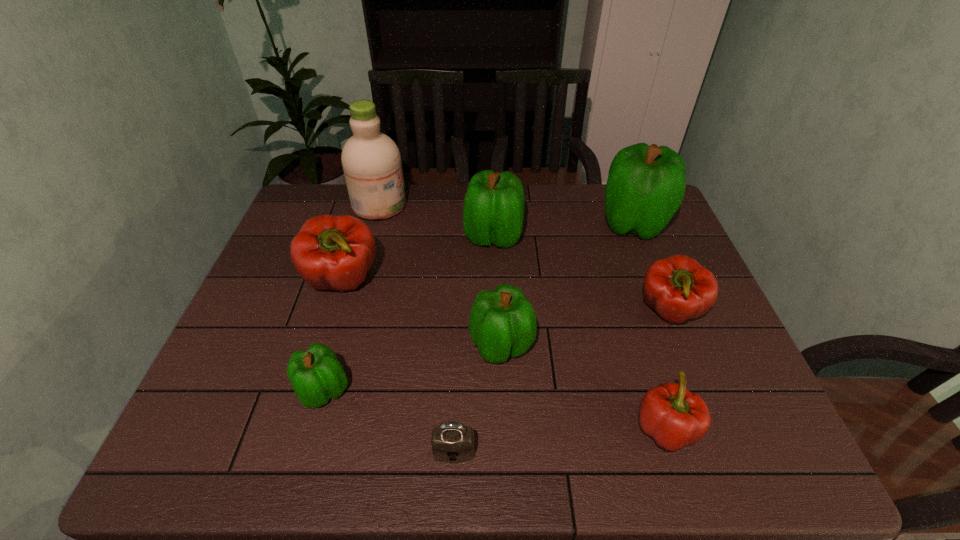
What are the coordinates of `free location located on the front label of the cleansing agent` in the screenshot? It's located at (502, 205).

The image size is (960, 540). Identify the location of free region located 0.140m on the front of the biggest green bell pepper. (655, 280).

Identify the location of vacant space situated on the right of the second biggest green bell pepper. coord(626,237).

Where is `free point located on the front of the leftmost pink bell pepper`? free point located on the front of the leftmost pink bell pepper is located at coordinates (327, 335).

Identify the location of free spot located 0.250m on the right of the second smallest green bell pepper. The image size is (960, 540). (636, 346).

You are a GUI agent. You are given a task and a screenshot of the screen. Output one action in this format:
    pyautogui.click(x=<x>, y=<y>)
    Task: Click on the vacant space located on the front of the second smallest pink bell pepper
    This screenshot has width=960, height=540.
    Given the screenshot: What is the action you would take?
    click(x=704, y=397)

You are a GUI agent. You are given a task and a screenshot of the screen. Output one action in this format:
    pyautogui.click(x=<x>, y=<y>)
    Task: Click on the vacant region located 0.190m on the left of the leftmost green bell pepper
    
    Given the screenshot: What is the action you would take?
    pyautogui.click(x=212, y=391)

Where is `free space located on the back of the smallest pink bell pepper`? The height and width of the screenshot is (540, 960). free space located on the back of the smallest pink bell pepper is located at coordinates (648, 376).

Where is `cleansing agent located in the far edge section of the desktop`? Image resolution: width=960 pixels, height=540 pixels. cleansing agent located in the far edge section of the desktop is located at coordinates tap(371, 161).

Where is `bell pepper that is at the near edge`? Image resolution: width=960 pixels, height=540 pixels. bell pepper that is at the near edge is located at coordinates (673, 416).